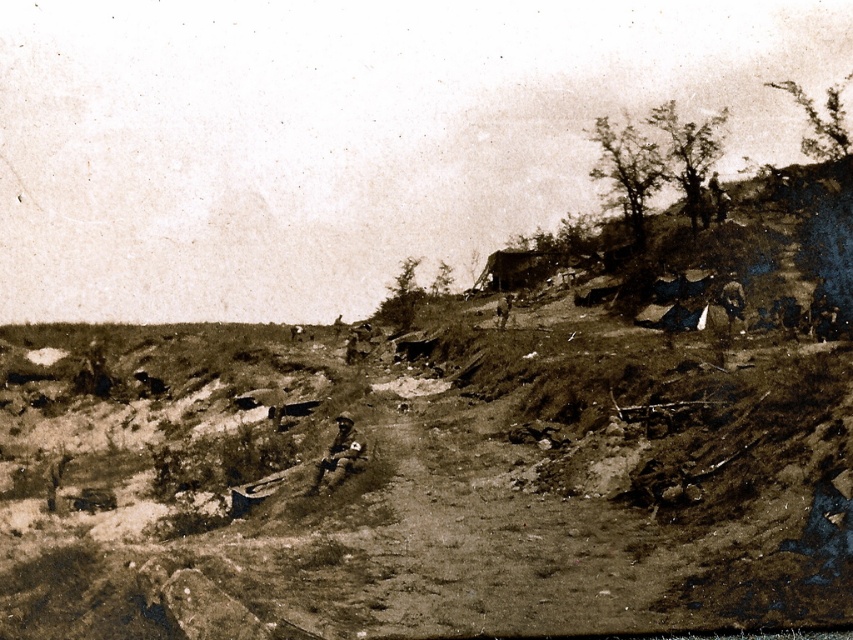
You are a photographer analyzing this historical image. You notice two jackets in the scene. The first is a brown leather jacket at center, and the second is a dark brown leather jacket at upper right. Based on their positions, which jacket appears closer to the camera?

The brown leather jacket at center appears closer to the camera because it is not as tall as the dark brown leather jacket at upper right, indicating it is positioned nearer in the scene.

You are a photographer standing at the camera position. You want to take a photo of the dark brown leather jacket at upper right. Is the jacket within your camera lens range of 60 meters?

The dark brown leather jacket at upper right and camera are 59.68 meters apart, so yes, the jacket is within the camera lens range of 60 meters.